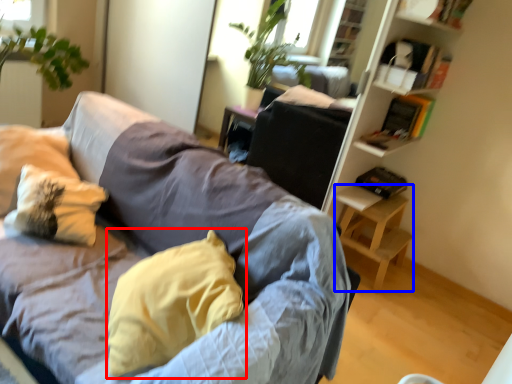
Question: Which object appears farthest to the camera in this image, pillow (highlighted by a red box) or table (highlighted by a blue box)?

Choices:
 (A) pillow
 (B) table

Answer: (B)